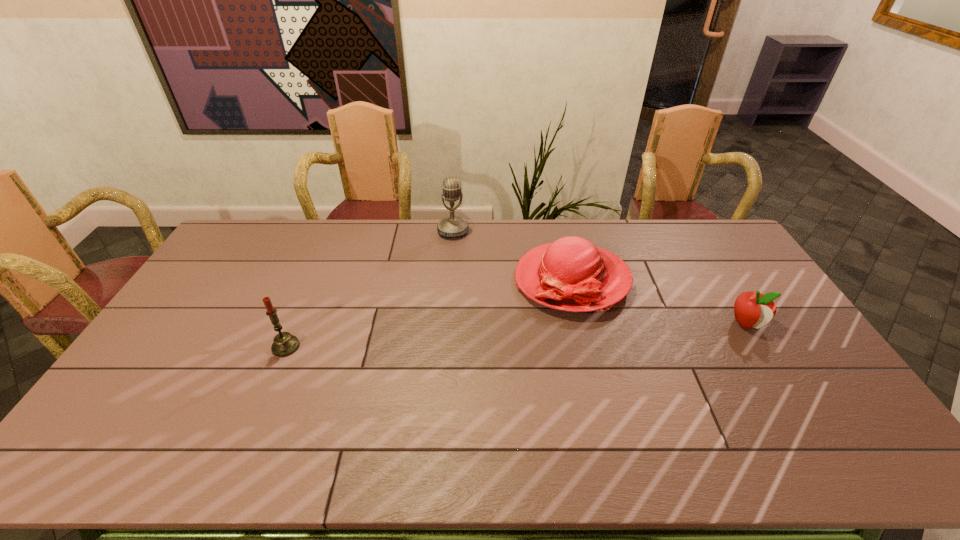
The image size is (960, 540). Find the location of `vacant space at the near edge of the desktop`. vacant space at the near edge of the desktop is located at coordinates (266, 424).

Identify the location of vacant space at the left edge of the desktop. This screenshot has height=540, width=960. (216, 268).

This screenshot has width=960, height=540. In the image, there is a desktop. In order to click on vacant space at the far right corner in this screenshot , I will do `click(715, 223)`.

You are a GUI agent. You are given a task and a screenshot of the screen. Output one action in this format:
    pyautogui.click(x=<x>, y=<y>)
    Task: Click on the empty space between the hat and the leftmost object
    The width and height of the screenshot is (960, 540).
    Given the screenshot: What is the action you would take?
    pyautogui.click(x=429, y=313)

The height and width of the screenshot is (540, 960). What are the coordinates of `empty space that is in between the leftmost object and the microphone` in the screenshot? It's located at (370, 289).

Image resolution: width=960 pixels, height=540 pixels. In order to click on free space between the nearest object and the rightmost object in this screenshot , I will do `click(516, 335)`.

You are a GUI agent. You are given a task and a screenshot of the screen. Output one action in this format:
    pyautogui.click(x=<x>, y=<y>)
    Task: Click on the empty space between the second shortest object and the candle
    This screenshot has width=960, height=540.
    Given the screenshot: What is the action you would take?
    pyautogui.click(x=429, y=313)

At what (x,y) coordinates should I click in order to perform the action: click on vacant space in between the nearest object and the second object from right to left. Please return your answer as a coordinate pair (x, y). Looking at the image, I should click on (429, 313).

You are a GUI agent. You are given a task and a screenshot of the screen. Output one action in this format:
    pyautogui.click(x=<x>, y=<y>)
    Task: Click on the free space between the hat and the candle
    
    Given the screenshot: What is the action you would take?
    pyautogui.click(x=429, y=313)

In order to click on object identified as the third closest to the apple in this screenshot , I will do `click(285, 344)`.